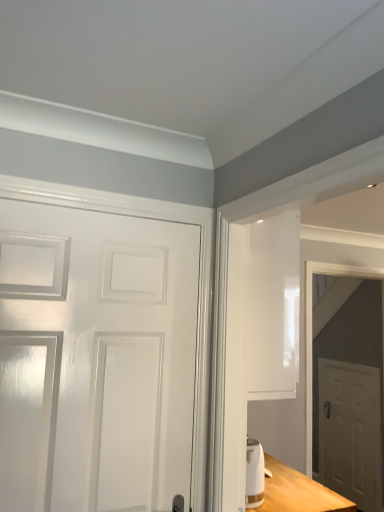
Image resolution: width=384 pixels, height=512 pixels. What are the coordinates of `free point above white glossy door at left, the 1th door viewed from the top (from a real-world perspective)` in the screenshot? It's located at (117, 210).